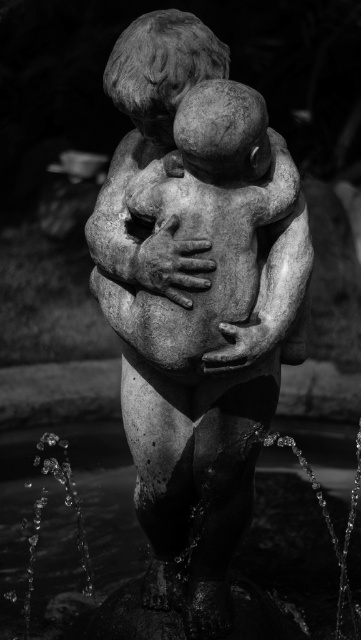
Question: Is stone statue at center bigger than sparkling water at statue center?

Choices:
 (A) no
 (B) yes

Answer: (A)

Question: Does stone statue at center lie in front of sparkling water at statue center?

Choices:
 (A) no
 (B) yes

Answer: (B)

Question: Where is stone statue at center located in relation to sparkling water at statue center in the image?

Choices:
 (A) left
 (B) right

Answer: (B)

Question: Which of the following is the closest to the observer?

Choices:
 (A) sparkling water at statue center
 (B) stone statue at center

Answer: (B)